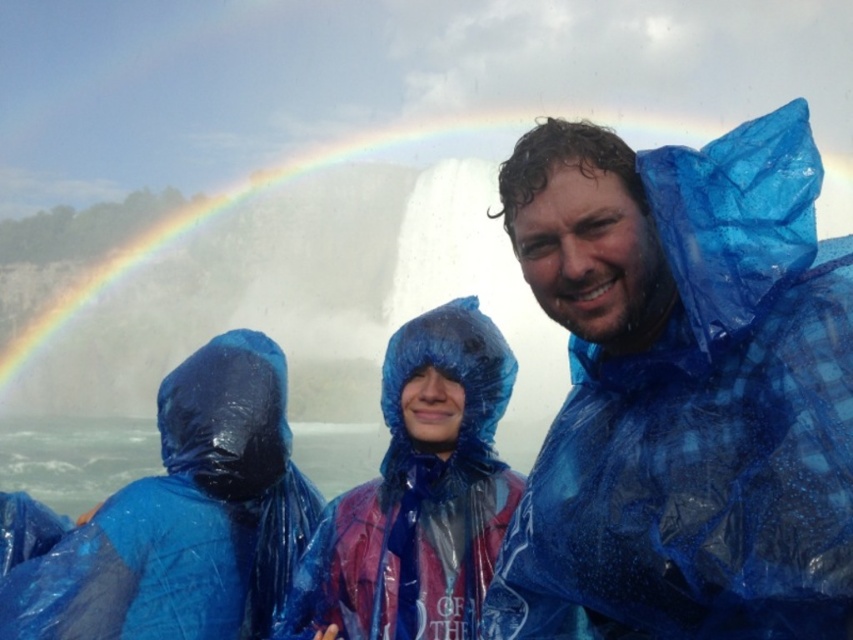
Question: Among these points, which one is nearest to the camera?

Choices:
 (A) (227, 410)
 (B) (372, 620)
 (C) (543, 481)

Answer: (C)

Question: Can you confirm if blue translucent raincoat at center is positioned to the left of blue translucent poncho at left?

Choices:
 (A) yes
 (B) no

Answer: (B)

Question: Is blue translucent raincoat at center positioned behind transparent blue poncho at center?

Choices:
 (A) yes
 (B) no

Answer: (B)

Question: Is blue translucent raincoat at center bigger than blue translucent poncho at left?

Choices:
 (A) yes
 (B) no

Answer: (A)

Question: Which object is closer to the camera taking this photo?

Choices:
 (A) blue translucent poncho at left
 (B) blue translucent raincoat at center
 (C) transparent blue poncho at center

Answer: (B)

Question: Among these points, which one is nearest to the camera?

Choices:
 (A) (251, 410)
 (B) (560, 147)

Answer: (B)